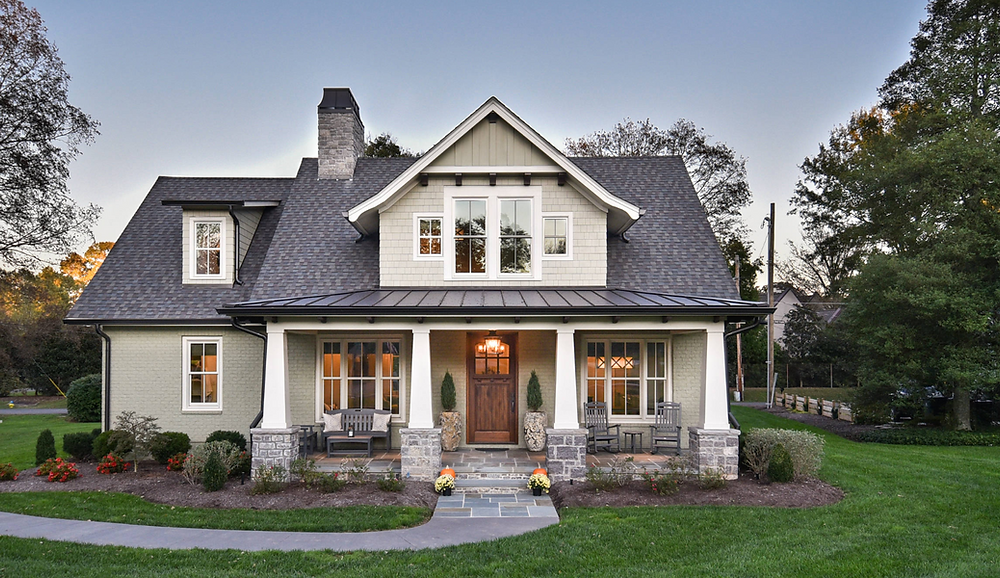
Find the location of a particular element. Image resolution: width=1000 pixels, height=578 pixels. column base is located at coordinates (270, 450), (423, 453), (567, 453), (725, 446).